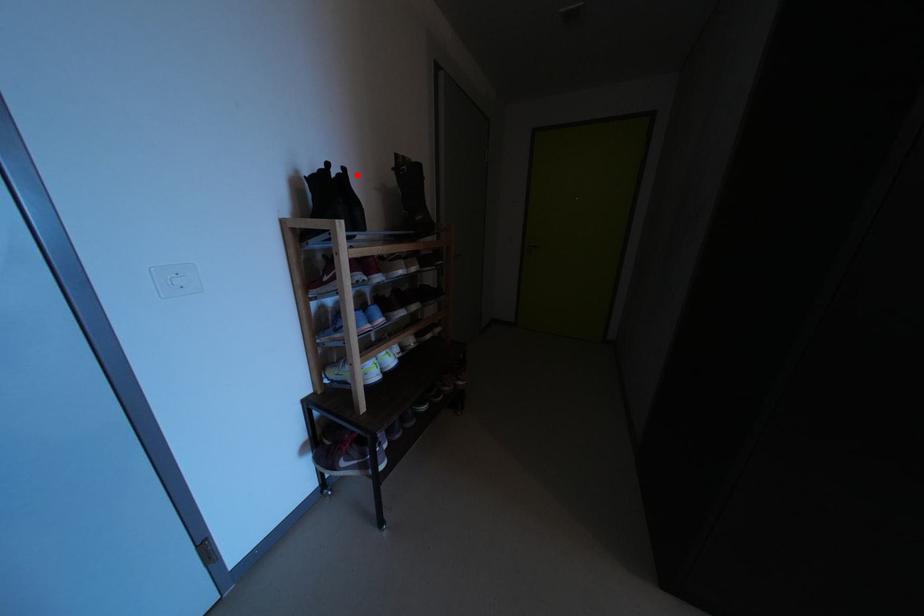
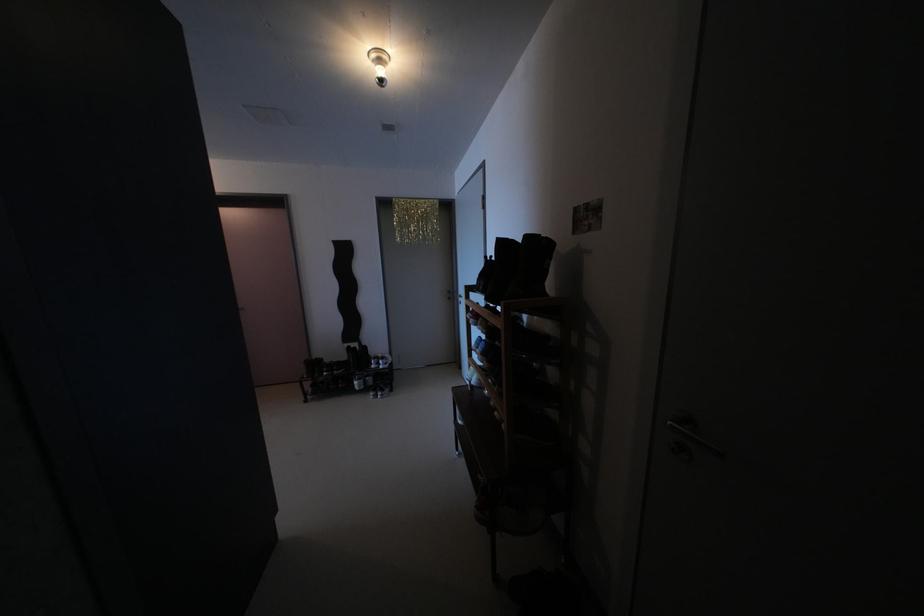
Where in the second image is the point corresponding to the highlighted location from the first image?

(504, 262)